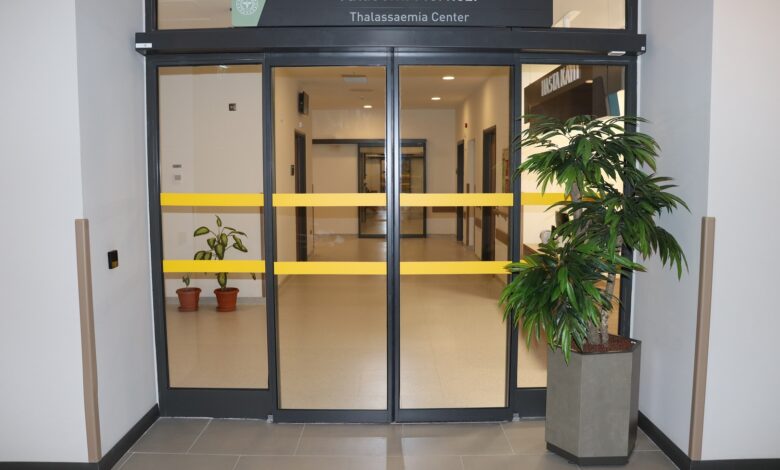
Where is `interior light sources`? This screenshot has width=780, height=470. interior light sources is located at coordinates (364, 107), (434, 96), (445, 77).